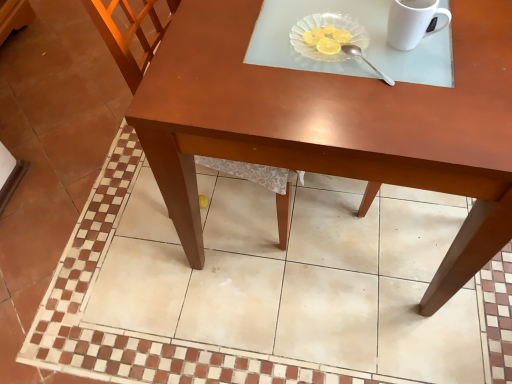
Question: Is matte wood table at center bigger or smaller than silver metallic spoon at upper center?

Choices:
 (A) big
 (B) small

Answer: (A)

Question: Visually, is matte wood table at center positioned to the left or to the right of silver metallic spoon at upper center?

Choices:
 (A) left
 (B) right

Answer: (B)

Question: Which is farther from the matte brown table at center?

Choices:
 (A) white glossy mug at upper right
 (B) matte wood table at center
 (C) silver metallic spoon at upper center
 (D) transparent glass plate at upper center
 (E) wooden chair at center

Answer: (A)

Question: Which object is the closest to the matte brown table at center?

Choices:
 (A) transparent glass plate at upper center
 (B) wooden chair at center
 (C) matte wood table at center
 (D) silver metallic spoon at upper center
 (E) white glossy mug at upper right

Answer: (C)